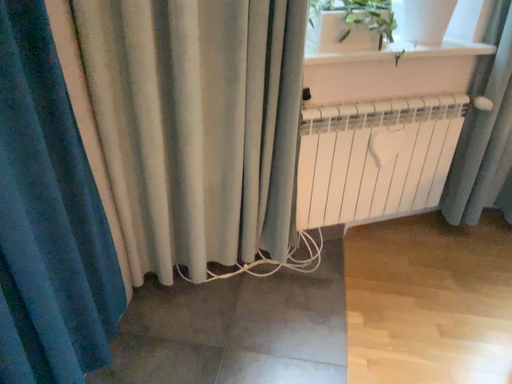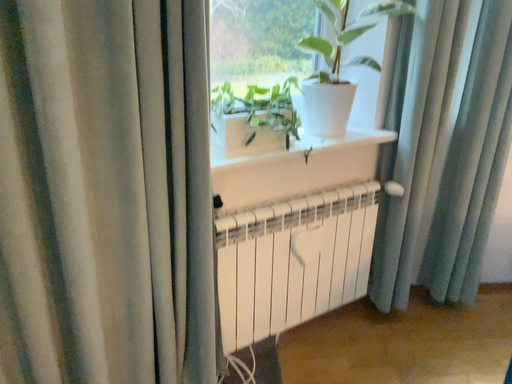
Question: Which way did the camera rotate in the video?

Choices:
 (A) rotated upward
 (B) rotated downward

Answer: (A)